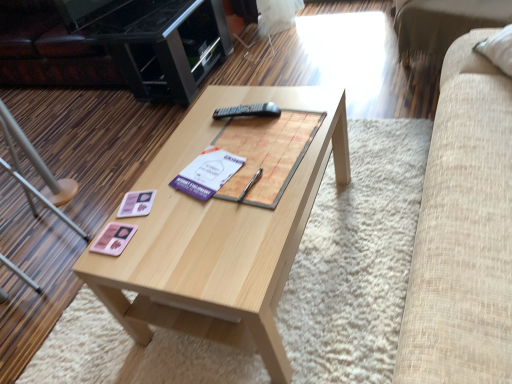
You are a GUI agent. You are given a task and a screenshot of the screen. Output one action in this format:
    pyautogui.click(x=<x>, y=<y>)
    Task: Click on the free space in front of wooden magazine at center
    Image resolution: width=512 pixels, height=384 pixels.
    Given the screenshot: What is the action you would take?
    click(x=237, y=239)